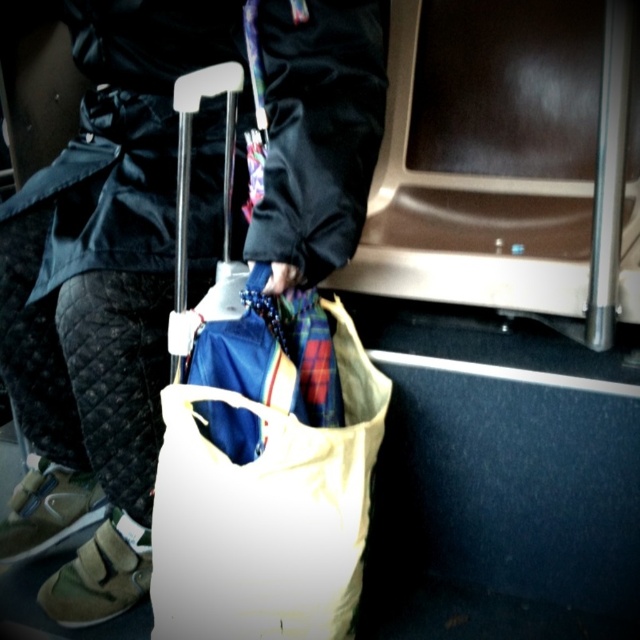
You are a traveler with a 36 inch carryon. You are sitting in the scene and want to place your carryon at the point marked by coordinates point (54, 433). Can you safely place your carryon there without it falling off the seat?

The distance between point (54, 433) and the camera is 39.24 inches. Since your carryon is 36 inches, it will fit safely at that point without falling off.

You are a passenger on a crowded train and need to store your belongings. You have a matte black jacket at center and a white canvas bag at center. Which item should you choose to place under the seat in front of you if you want to save space?

The white canvas bag at center is smaller in size than the matte black jacket at center, so it would save more space if placed under the seat.